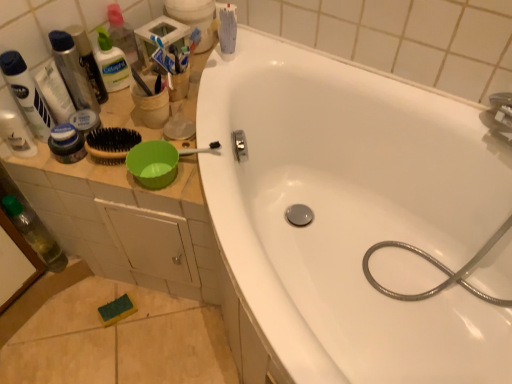
At what (x,y) coordinates should I click in order to perform the action: click on vacant space in front of brown bristle brush at upper left. Please return your answer as a coordinate pair (x, y). Looking at the image, I should click on (145, 146).